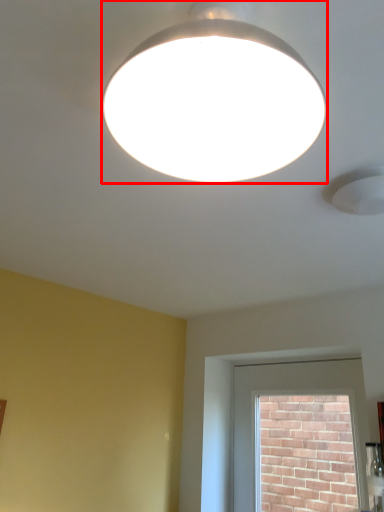
Question: From the image, what is the correct spatial relationship of lamp (annotated by the red box) in relation to window?

Choices:
 (A) left
 (B) right

Answer: (A)